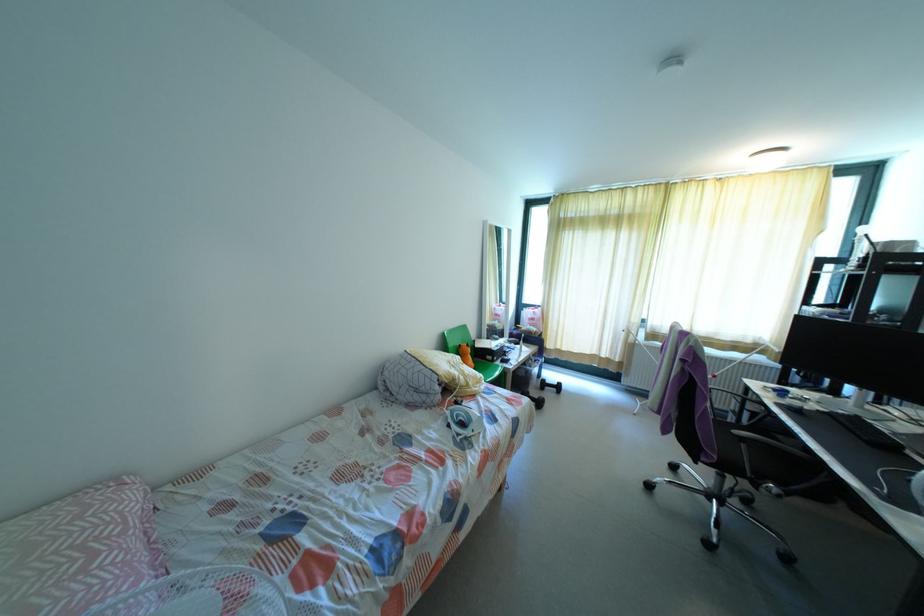
Identify the location of orange plush toy. (466, 355).